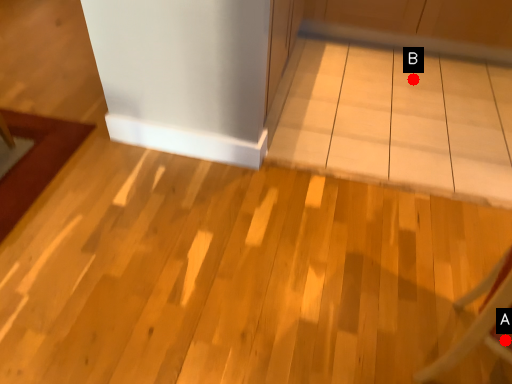
Question: Two points are circled on the image, labeled by A and B beside each circle. Which of the following is the farthest from the observer?

Choices:
 (A) A is further
 (B) B is further

Answer: (B)